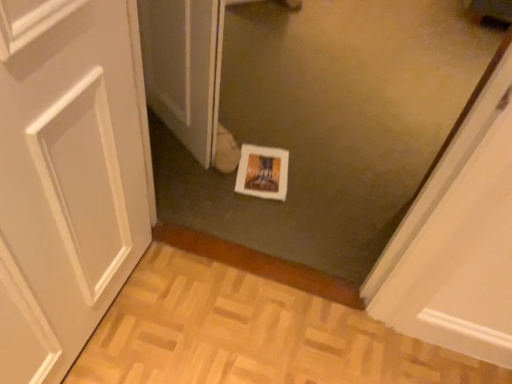
Where is `vacant space situated above white glossy print at center (from a real-world perspective)`? Image resolution: width=512 pixels, height=384 pixels. vacant space situated above white glossy print at center (from a real-world perspective) is located at coordinates (262, 166).